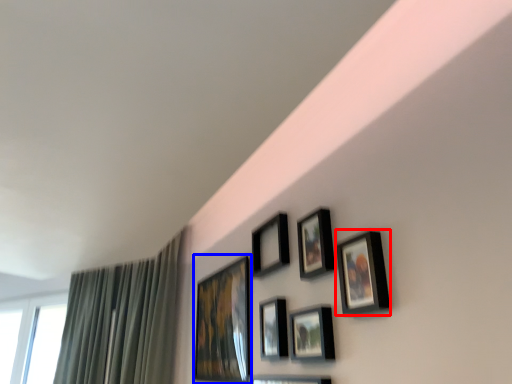
Question: Which object appears closest to the camera in this image, picture frame (highlighted by a red box) or picture frame (highlighted by a blue box)?

Choices:
 (A) picture frame
 (B) picture frame

Answer: (A)